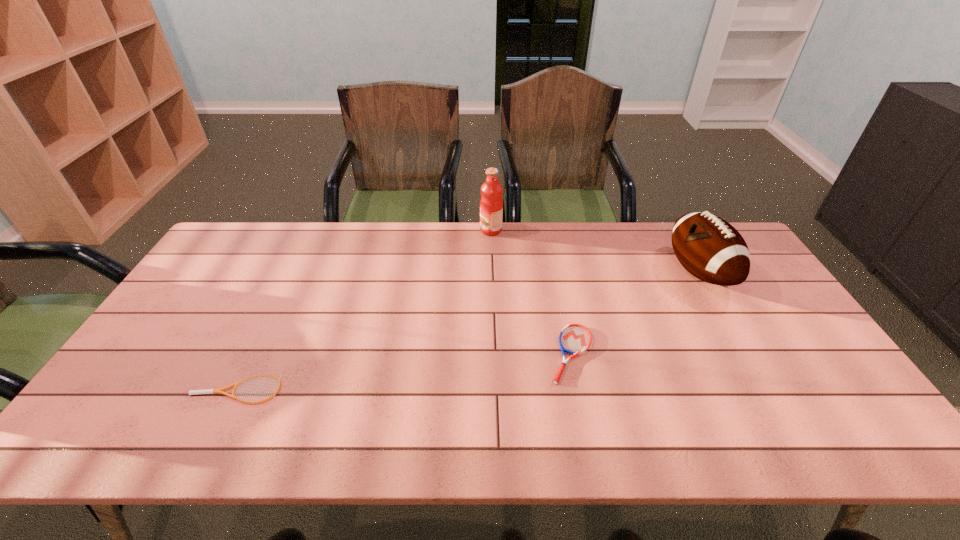
Locate an element on the screen. Image resolution: width=960 pixels, height=540 pixels. vacant space at the far left corner of the desktop is located at coordinates (269, 228).

Where is `vacant space that is in between the third object from right to left and the left tennis racket`? vacant space that is in between the third object from right to left and the left tennis racket is located at coordinates (x=364, y=310).

This screenshot has height=540, width=960. In order to click on empty space between the second object from left to right and the football (American) in this screenshot , I will do `click(595, 251)`.

Find the location of a particular element. This screenshot has width=960, height=540. vacant area that lies between the tallest object and the football (American) is located at coordinates (595, 251).

I want to click on vacant space in between the third shortest object and the second object from left to right, so click(595, 251).

Identify the location of unoccupied position between the leftmost object and the second object from right to left. (404, 372).

You are a GUI agent. You are given a task and a screenshot of the screen. Output one action in this format:
    pyautogui.click(x=<x>, y=<y>)
    Task: Click on the vacant area that lies between the farthest object and the rightmost object
    The height and width of the screenshot is (540, 960).
    Given the screenshot: What is the action you would take?
    pyautogui.click(x=595, y=251)

Identify the location of free space between the second object from left to right and the football (American). (595, 251).

This screenshot has width=960, height=540. I want to click on vacant point located between the fruit juice and the third nearest object, so click(595, 251).

This screenshot has width=960, height=540. In order to click on vacant point located between the leftmost object and the farthest object in this screenshot , I will do `click(364, 310)`.